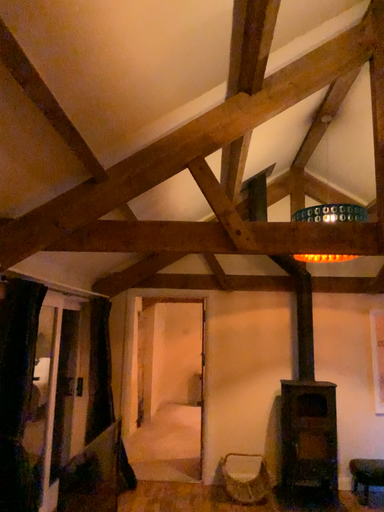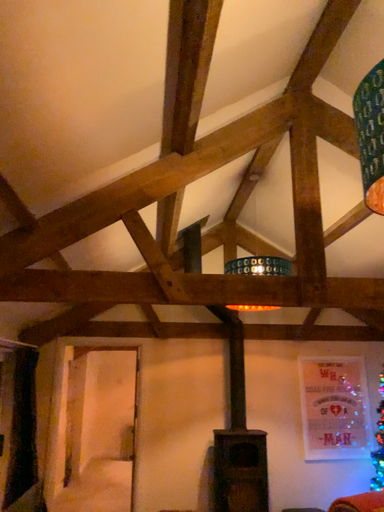
Question: Which way did the camera rotate in the video?

Choices:
 (A) rotated left
 (B) rotated right

Answer: (B)